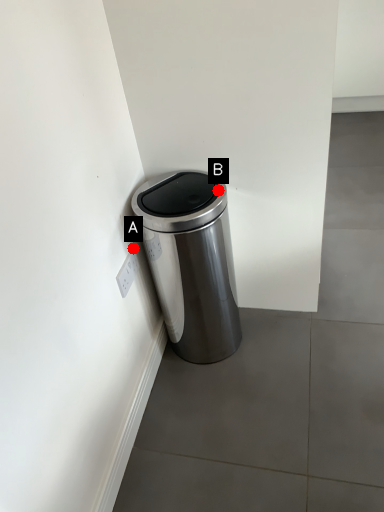
Question: Two points are circled on the image, labeled by A and B beside each circle. Which of the following is the farthest from the observer?

Choices:
 (A) A is further
 (B) B is further

Answer: (A)